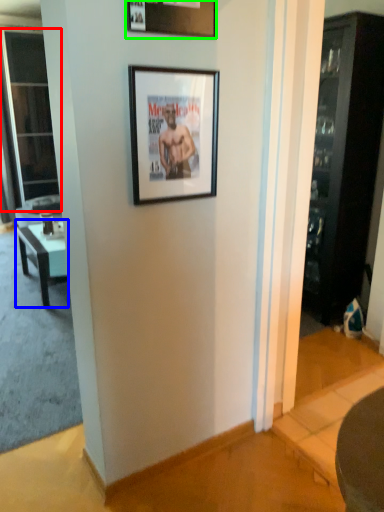
Question: Estimate the real-world distances between objects in this image. Which object is farther from screen door (highlighted by a red box), table (highlighted by a blue box) or picture frame (highlighted by a green box)?

Choices:
 (A) table
 (B) picture frame

Answer: (B)